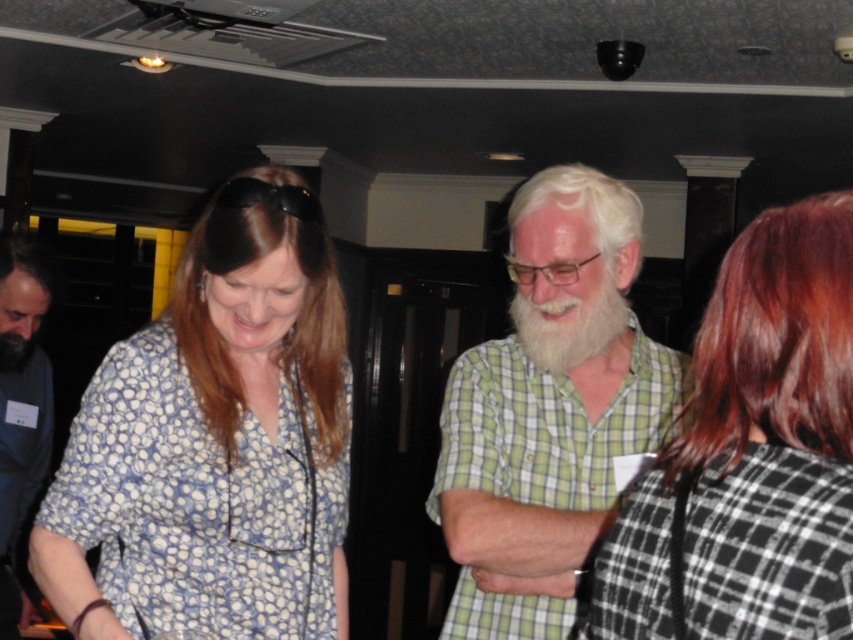
Between black and white checkered shirt at upper right and black fuzzy beard at lower left, which one has more height?

With more height is black and white checkered shirt at upper right.

Is point (807, 253) in front of point (3, 369)?

Yes, point (807, 253) is closer to viewer.

This screenshot has height=640, width=853. Find the location of `black and white checkered shirt at upper right`. black and white checkered shirt at upper right is located at coordinates 751,456.

Where is `black and white checkered shirt at upper right`? This screenshot has height=640, width=853. black and white checkered shirt at upper right is located at coordinates click(x=751, y=456).

Who is shorter, dark red silky hair at right or black fuzzy beard at lower left?

black fuzzy beard at lower left is shorter.

Does dark red silky hair at right have a lesser width compared to black fuzzy beard at lower left?

Incorrect, dark red silky hair at right's width is not less than black fuzzy beard at lower left's.

Does point (833, 381) lie behind point (16, 355)?

No, it is in front of (16, 355).

Image resolution: width=853 pixels, height=640 pixels. I want to click on dark red silky hair at right, so click(773, 342).

Based on the photo, can you confirm if blue dotted shirt at left is smaller than green checkered shirt at center?

Actually, blue dotted shirt at left might be larger than green checkered shirt at center.

What do you see at coordinates (215, 440) in the screenshot? This screenshot has width=853, height=640. I see `blue dotted shirt at left` at bounding box center [215, 440].

Where is `blue dotted shirt at left`? The height and width of the screenshot is (640, 853). blue dotted shirt at left is located at coordinates (215, 440).